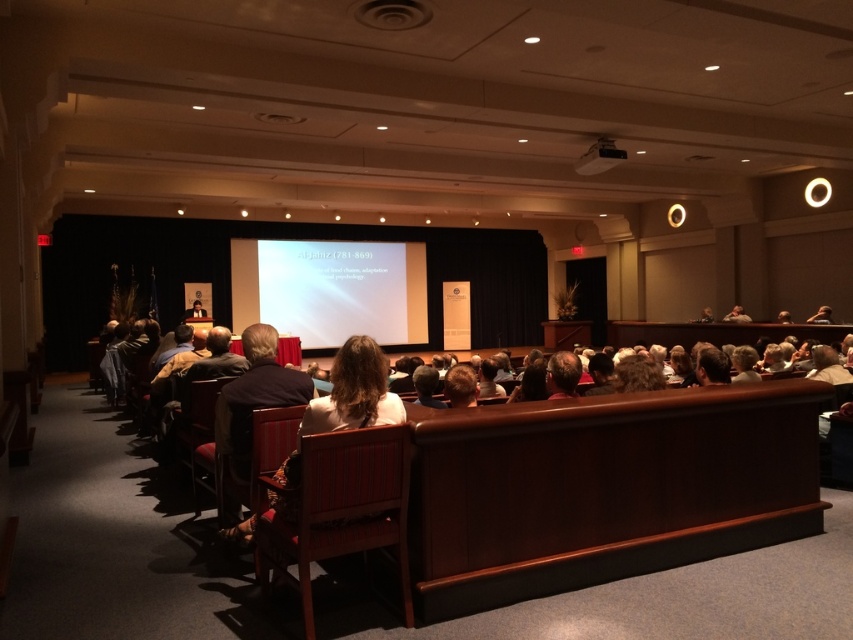
You are an event planner setting up for a presentation. You have a white matte projection screen at center and a white fabric chair at center. Based on the scene, which object is wider?

The white matte projection screen at center is wider than the white fabric chair at center according to the description.

From the picture: You are standing at the point marked as point (x=260, y=531) in the auditorium. You want to take a photo of the stage with your camera. The camera is 9.92 feet away from the point. Can you capture the entire stage in your photo?

Yes, since the camera is 9.92 feet away from point (x=260, y=531), which is your current position, you can capture the entire stage in your photo.

You are an event organizer who needs to ensure that the wooden chair at center and the black plastic projector at upper center fit through a doorway that is 1.2 meters wide. Based on their widths, can both items pass through the doorway simultaneously?

The wooden chair at center has a larger width than the black plastic projector at upper center. Since the doorway is 1.2 meters wide, if the combined width of both items exceeds 1.2 meters, they cannot pass through simultaneously. However, since the exact widths are not provided, we cannot definitively determine if they can fit together. However, if the wooden chair alone is wider than 1.2 meters, it cannot pass through even alone.